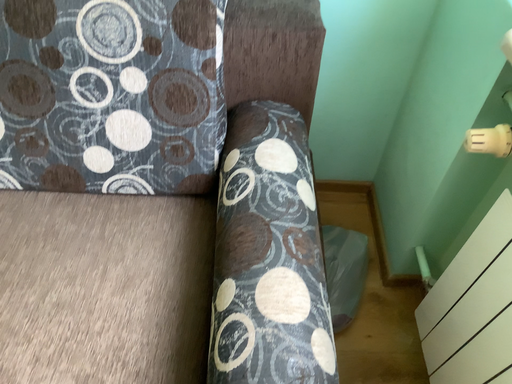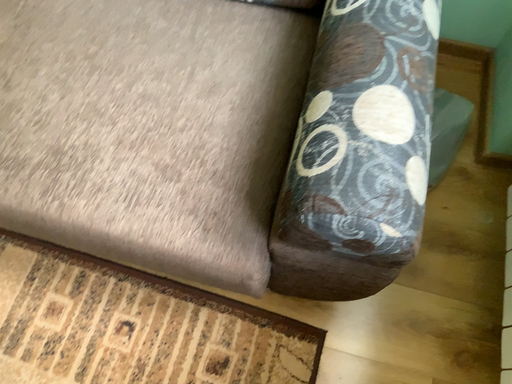
Question: Which way did the camera rotate in the video?

Choices:
 (A) rotated left
 (B) rotated right

Answer: (A)